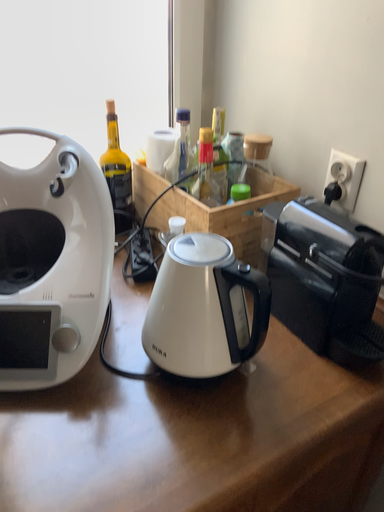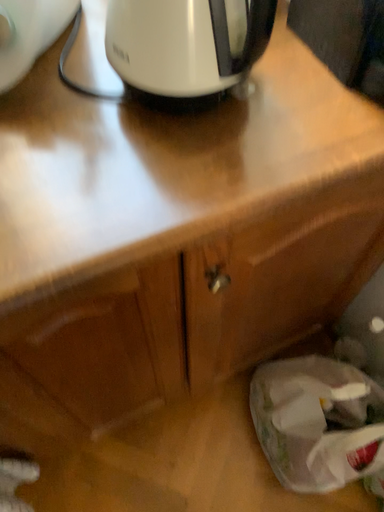
Question: Which way did the camera rotate in the video?

Choices:
 (A) rotated right
 (B) rotated left

Answer: (B)